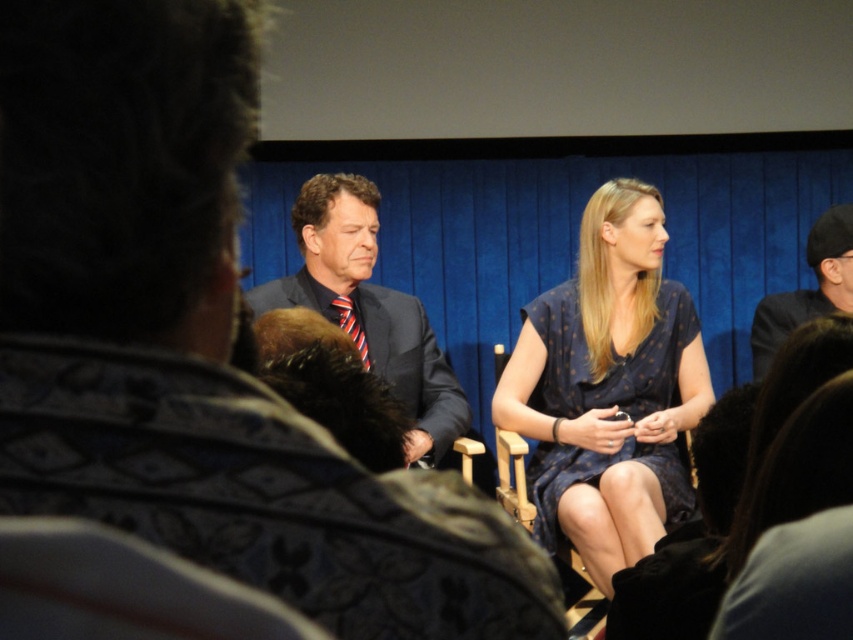
Question: Does matte black suit at left have a larger size compared to wooden chair at center?

Choices:
 (A) yes
 (B) no

Answer: (A)

Question: Is blue dotted dress at center above dark gray suit at right?

Choices:
 (A) no
 (B) yes

Answer: (A)

Question: Which of the following is the closest to the observer?

Choices:
 (A) wooden chair at center
 (B) matte black suit at left

Answer: (B)

Question: Considering the real-world distances, which object is farthest from the wooden chair at center?

Choices:
 (A) dark blue suit at center
 (B) blue dotted dress at center

Answer: (A)

Question: From the image, what is the correct spatial relationship of blue dotted dress at center in relation to wooden chair at center?

Choices:
 (A) right
 (B) left

Answer: (A)

Question: Estimate the real-world distances between objects in this image. Which object is closer to the blue dotted dress at center?

Choices:
 (A) matte black suit at left
 (B) dark gray suit at right
 (C) wooden chair at center

Answer: (C)